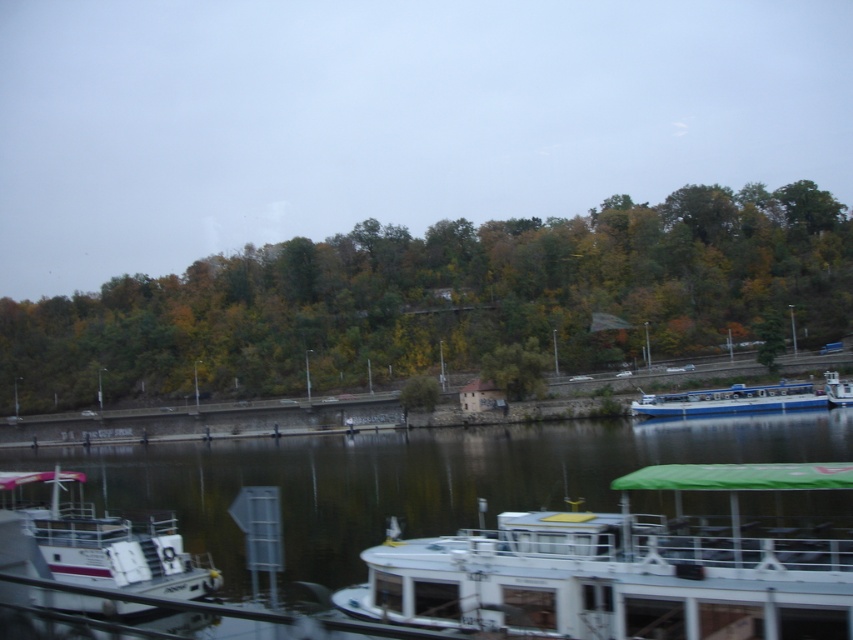
Between point (306, 272) and point (776, 488), which one is positioned in front?

Point (776, 488) is in front.

Is green leafy trees at center taller than white glossy boat at lower center?

Yes, green leafy trees at center is taller than white glossy boat at lower center.

Between point (291, 374) and point (666, 483), which one is positioned behind?

Positioned behind is point (291, 374).

Identify the location of green leafy trees at center. This screenshot has height=640, width=853. (445, 298).

Who is taller, white glossy boat at lower center or white plastic boat at lower left?

Standing taller between the two is white glossy boat at lower center.

Is white glossy boat at lower center bigger than white plastic boat at lower left?

Indeed, white glossy boat at lower center has a larger size compared to white plastic boat at lower left.

Locate an element on the screen. white glossy boat at lower center is located at coordinates (622, 568).

Where is `white glossy boat at lower center`? This screenshot has width=853, height=640. white glossy boat at lower center is located at coordinates (622, 568).

Does green leafy trees at center have a greater height compared to white plastic boat at lower left?

Yes.

Between green leafy trees at center and white plastic boat at lower left, which one is positioned higher?

green leafy trees at center is above.

What do you see at coordinates (445, 298) in the screenshot?
I see `green leafy trees at center` at bounding box center [445, 298].

I want to click on green leafy trees at center, so click(x=445, y=298).